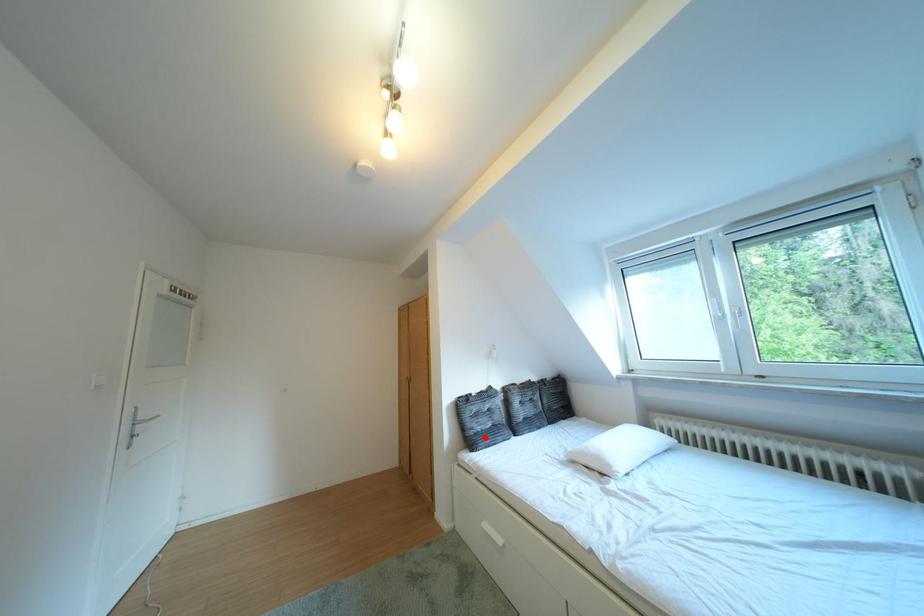
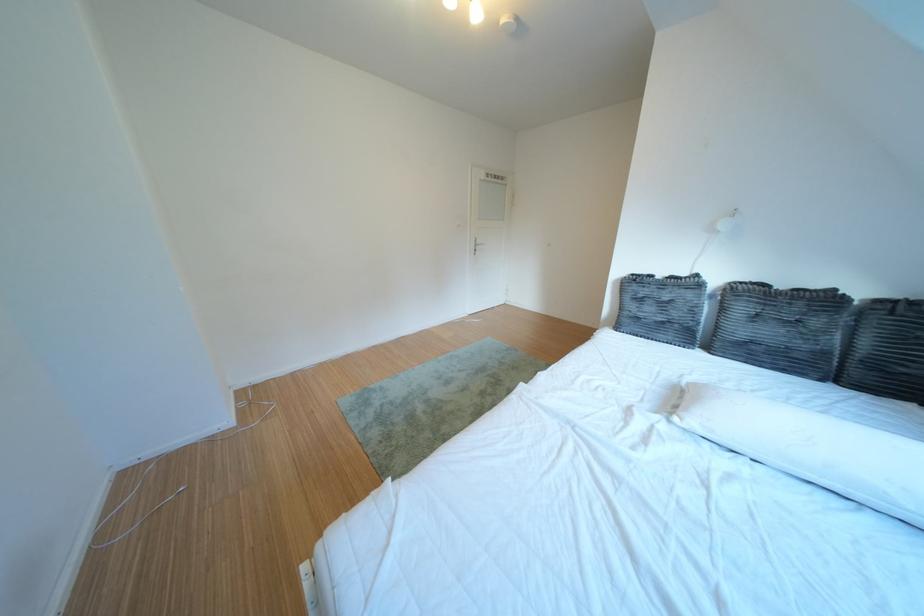
Where in the second image is the point corresponding to the highlighted location from the first image?

(639, 318)